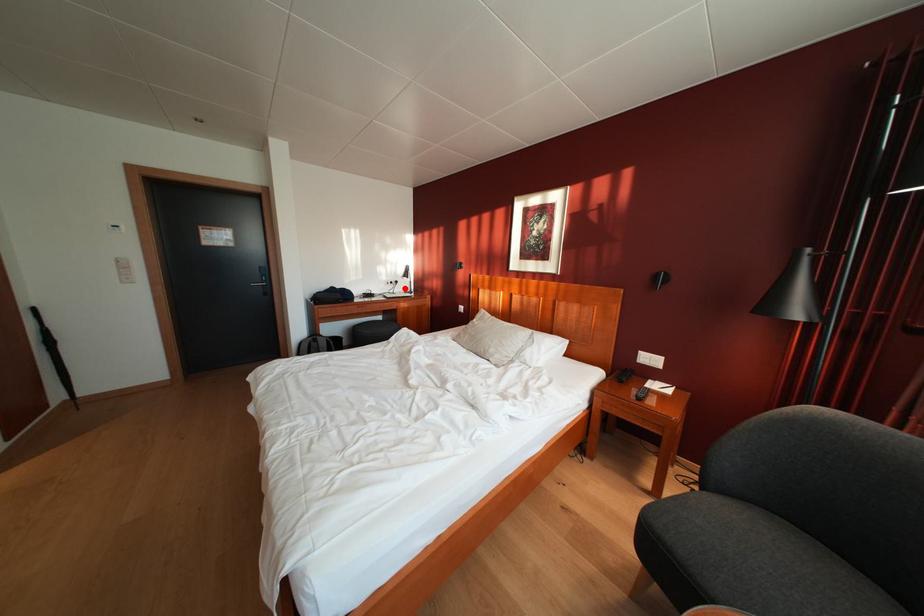
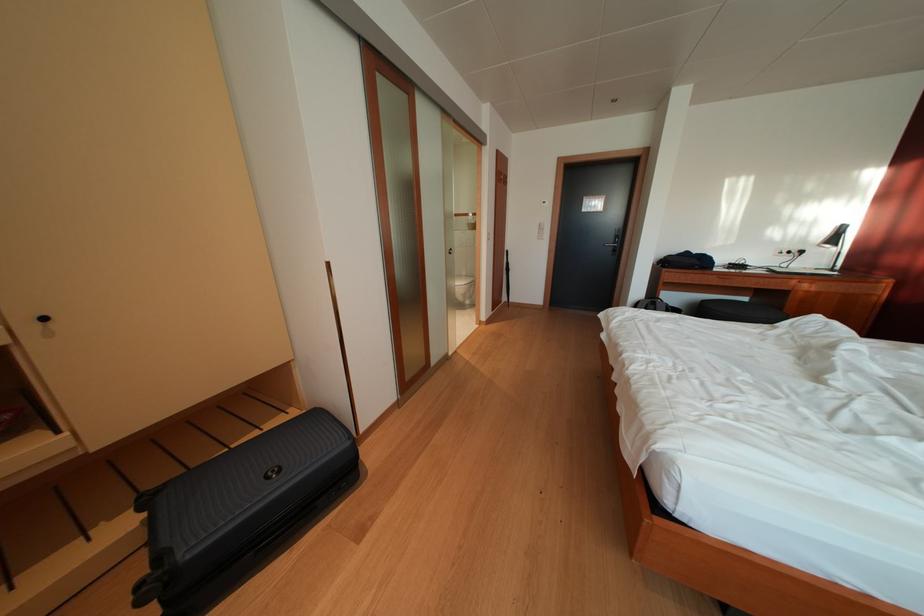
Question: A red point is marked in image1. In image2, is the corresponding 3D point closer to the camera or farther? Reply with the corresponding letter.

Choices:
 (A) The corresponding 3D point is closer.
 (B) The corresponding 3D point is farther.

Answer: (B)